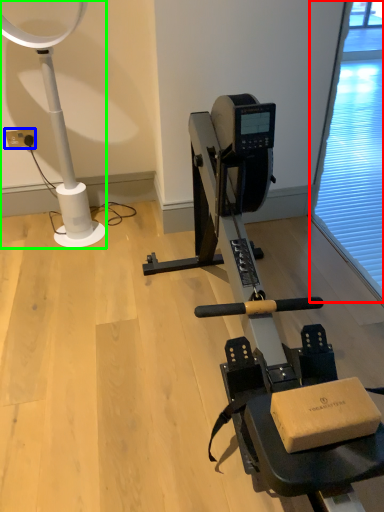
Question: Considering the real-world distances, which object is farthest from screen door (highlighted by a red box)? electric outlet (highlighted by a blue box) or lamp (highlighted by a green box)?

Choices:
 (A) electric outlet
 (B) lamp

Answer: (A)